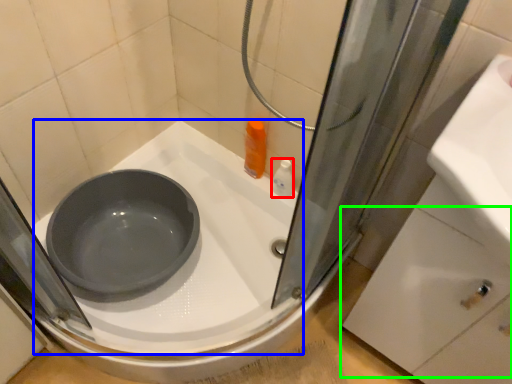
Question: Which object is the farthest from toiletry (highlighted by a red box)? Choose among these: bath (highlighted by a blue box) or drawer (highlighted by a green box).

Choices:
 (A) bath
 (B) drawer

Answer: (B)